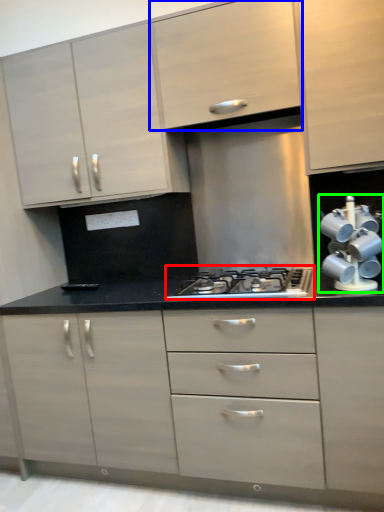
Question: Which object is positioned closest to gas stove (highlighted by a red box)? Select from cabinetry (highlighted by a blue box) and appliance (highlighted by a green box).

Choices:
 (A) cabinetry
 (B) appliance

Answer: (B)